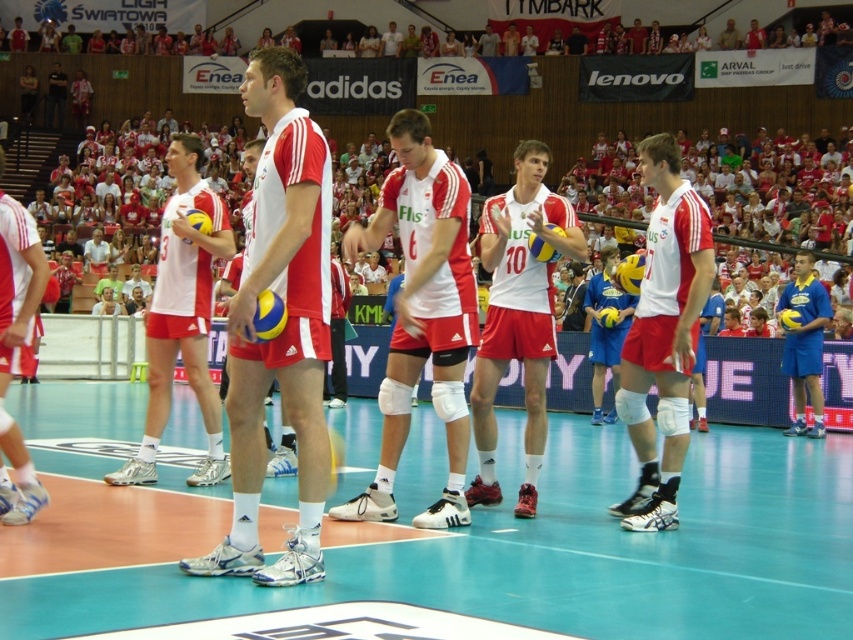
Does point (485, 456) lie behind point (218, 435)?

No, it is not.

Who is more forward, [480,426] or [154,314]?

Positioned in front is point [480,426].

Who is more forward, (538, 360) or (204, 417)?

Positioned in front is point (538, 360).

Locate an element on the screen. The image size is (853, 640). matte white jersey at center is located at coordinates (518, 316).

This screenshot has width=853, height=640. Identify the location of white matte shorts at center. (663, 333).

Is white matte shorts at center to the right of matte white jersey at center from the viewer's perspective?

Correct, you'll find white matte shorts at center to the right of matte white jersey at center.

At what (x,y) coordinates should I click in order to perform the action: click on white matte shorts at center. Please return your answer as a coordinate pair (x, y). The image size is (853, 640). Looking at the image, I should click on tap(663, 333).

Find the location of a particular element. Image resolution: width=853 pixels, height=640 pixels. white matte shorts at center is located at coordinates (663, 333).

Which of these two, white matte volleyball at center or white matte shorts at left, stands shorter?

Standing shorter between the two is white matte shorts at left.

Image resolution: width=853 pixels, height=640 pixels. What do you see at coordinates (183, 316) in the screenshot?
I see `white matte volleyball at center` at bounding box center [183, 316].

Is point (160, 266) closer to camera compared to point (26, 289)?

That is False.

Where is `white matte volleyball at center`? white matte volleyball at center is located at coordinates (183, 316).